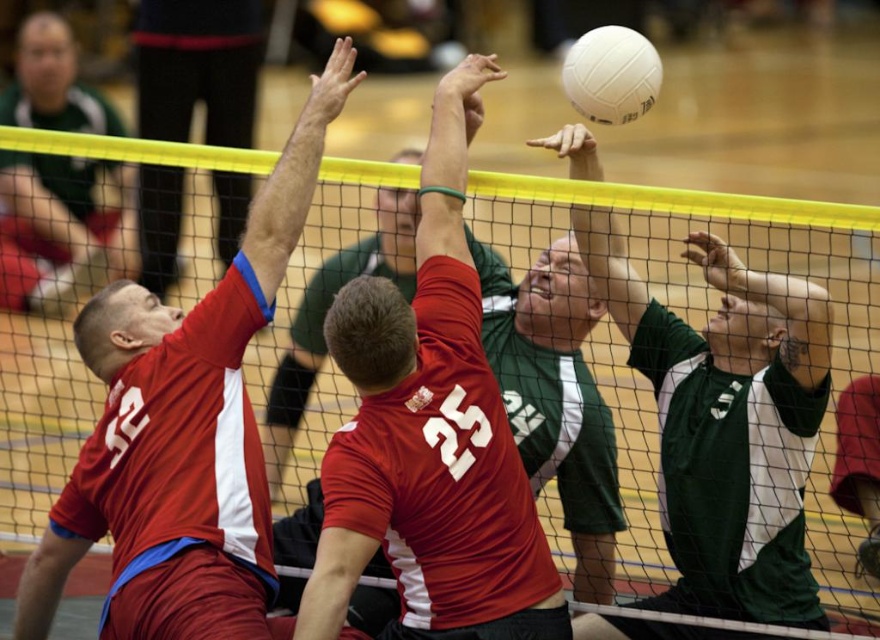
Is green jersey at upper center to the right of white matte volleyball at upper center from the viewer's perspective?

In fact, green jersey at upper center is to the left of white matte volleyball at upper center.

Can you confirm if green jersey at upper center is bigger than white matte volleyball at upper center?

Incorrect, green jersey at upper center is not larger than white matte volleyball at upper center.

Who is more distant from viewer, (x=772, y=433) or (x=612, y=72)?

Point (x=772, y=433)

At what (x,y) coordinates should I click in order to perform the action: click on green jersey at upper center. Please return your answer as a coordinate pair (x, y). This screenshot has width=880, height=640. Looking at the image, I should click on (726, 424).

In the scene shown: Who is positioned more to the left, matte red jersey at upper left or white matte volleyball at upper center?

matte red jersey at upper left is more to the left.

This screenshot has height=640, width=880. Describe the element at coordinates (184, 432) in the screenshot. I see `matte red jersey at upper left` at that location.

Locate an element on the screen. matte red jersey at upper left is located at coordinates (184, 432).

Is matte red jersey at center positioned in front of green jersey at upper center?

Yes, matte red jersey at center is in front of green jersey at upper center.

Describe the element at coordinates (430, 436) in the screenshot. The height and width of the screenshot is (640, 880). I see `matte red jersey at center` at that location.

At what (x,y) coordinates should I click in order to perform the action: click on matte red jersey at center. Please return your answer as a coordinate pair (x, y). The width and height of the screenshot is (880, 640). Looking at the image, I should click on (430, 436).